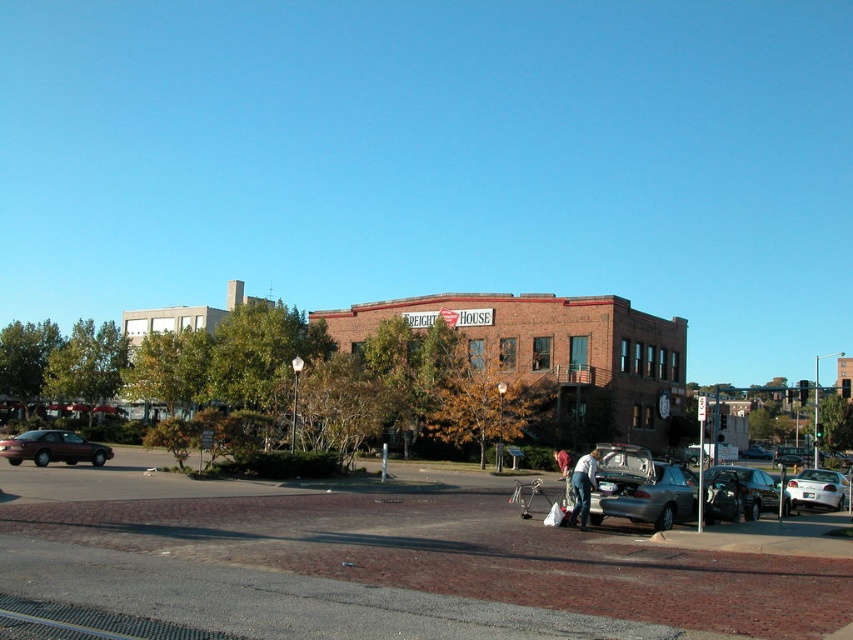
Who is positioned more to the left, shiny silver suv at lower right or silver metallic sedan at center?

Positioned to the left is shiny silver suv at lower right.

Find the location of `shiny silver suv at lower right`. shiny silver suv at lower right is located at coordinates (749, 484).

You are a GUI agent. You are given a task and a screenshot of the screen. Output one action in this format:
    pyautogui.click(x=<x>, y=<y>)
    Task: Click on the shiny silver suv at lower right
    The image size is (853, 640).
    Given the screenshot: What is the action you would take?
    pyautogui.click(x=749, y=484)

Is metallic gray sedan at center above denim jacket at lower center?

Yes, metallic gray sedan at center is above denim jacket at lower center.

Is point (624, 477) positioned in front of point (566, 467)?

Yes.

What are the coordinates of `metallic gray sedan at center` in the screenshot? It's located at (646, 497).

Is point (96, 448) more distant than point (752, 472)?

That is True.

Which is more to the left, shiny maroon sedan at left or shiny silver suv at lower right?

shiny maroon sedan at left is more to the left.

Consider the image. Who is more forward, (84, 454) or (788, 496)?

Point (788, 496) is in front.

You are a GUI agent. You are given a task and a screenshot of the screen. Output one action in this format:
    pyautogui.click(x=<x>, y=<y>)
    Task: Click on the shiny maroon sedan at left
    
    Given the screenshot: What is the action you would take?
    pyautogui.click(x=51, y=449)